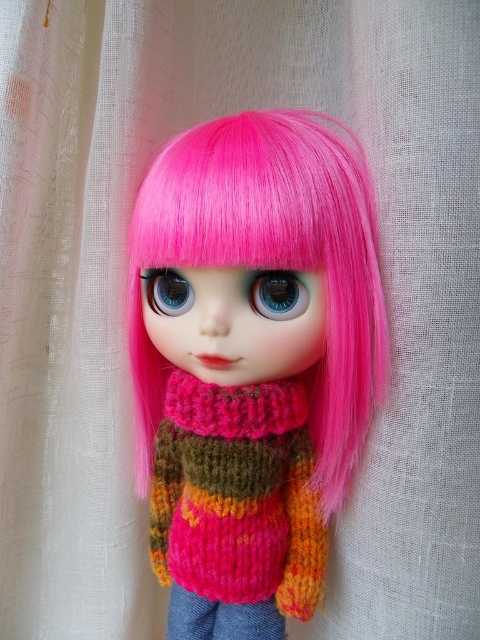
Question: Which point is farther to the camera?

Choices:
 (A) bluematteeye at center
 (B) knitted sweater at center

Answer: (A)

Question: Does knitted sweater at center come behind knitted wool sweater at center?

Choices:
 (A) no
 (B) yes

Answer: (A)

Question: Is knitted sweater at center to the left of knitted wool sweater at center from the viewer's perspective?

Choices:
 (A) no
 (B) yes

Answer: (A)

Question: Which object is closer to the camera taking this photo?

Choices:
 (A) knitted wool sweater at center
 (B) blue glossy eye at center
 (C) jeans at center

Answer: (B)

Question: Based on their relative distances, which object is farther from the knitted wool sweater at center?

Choices:
 (A) knitted sweater at center
 (B) bluematteeye at center
 (C) blue glossy eye at center

Answer: (B)

Question: Does knitted sweater at center appear over bluematteeye at center?

Choices:
 (A) no
 (B) yes

Answer: (A)